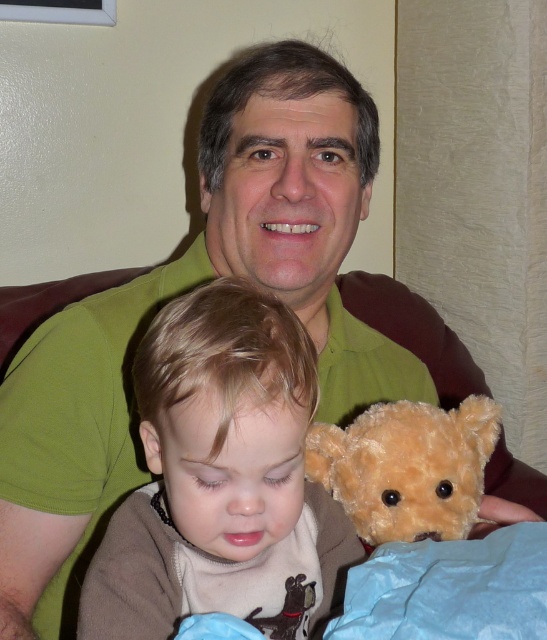
Is point (184, 394) closer to viewer compared to point (462, 481)?

Yes, it is in front of point (462, 481).

Who is more distant from viewer, (x=176, y=321) or (x=375, y=493)?

Positioned behind is point (x=375, y=493).

The width and height of the screenshot is (547, 640). Identify the location of soft brown teddy bear at center. click(222, 480).

At what (x,y) coordinates should I click in order to perform the action: click on soft brown teddy bear at center. Please return your answer as a coordinate pair (x, y). Looking at the image, I should click on tap(222, 480).